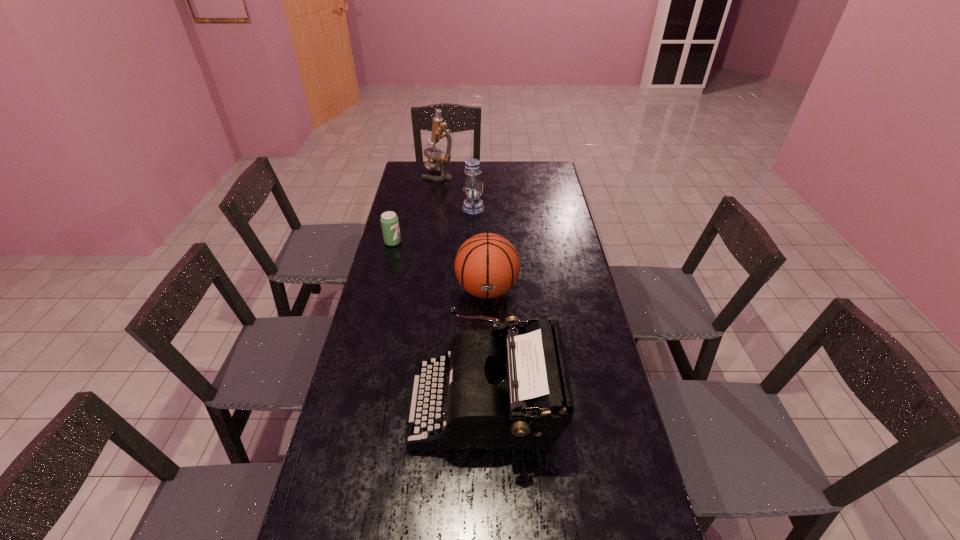
You are a GUI agent. You are given a task and a screenshot of the screen. Output one action in this format:
    pyautogui.click(x=<x>, y=<y>)
    Task: Click on the free space that satisfies the following two spatial constraints: 1. on the side where the inflation valve is located; 2. on the typing side of the fifth farthest object
    
    Given the screenshot: What is the action you would take?
    tap(489, 402)

At what (x,y) coordinates should I click in order to perform the action: click on free space that satisfies the following two spatial constraints: 1. on the side where the inflation valve is located; 2. on the typing side of the fifth farthest object. Please return your answer as a coordinate pair (x, y). Looking at the image, I should click on (489, 402).